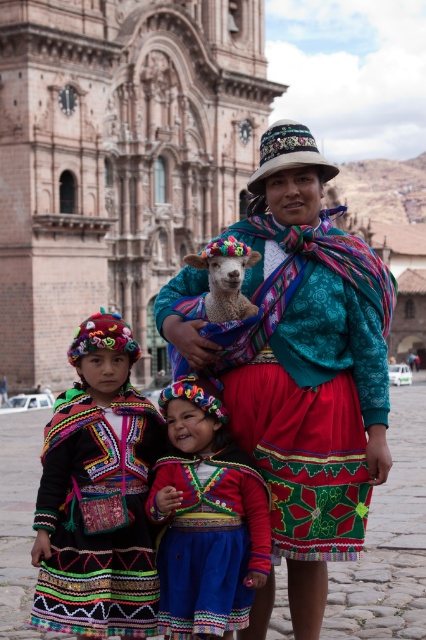
You are an anthropologist studying traditional Peruvian textiles. You notice a point in the image at coordinates (206,518). What cultural element is located at this point?

The point at coordinates (206,518) indicates a multicolored woven fabric at center, which is a traditional Peruvian textile element.

You are an anthropologist studying traditional Peruvian attire. You observe the textured woolen shawl at center and the multicolored woven fabric at center in the scene. Which item is positioned higher up on the person?

The textured woolen shawl at center is much taller as multicolored woven fabric at center, so the textured woolen shawl at center is positioned higher up on the person.

You are an anthropologist studying traditional Peruvian clothing. You notice the multicolored embroidered jacket at center and the fluffy woolen lamb at center in the scene. Which object is positioned lower in the image?

The multicolored embroidered jacket at center is below the fluffy woolen lamb at center, so it is positioned lower in the image.